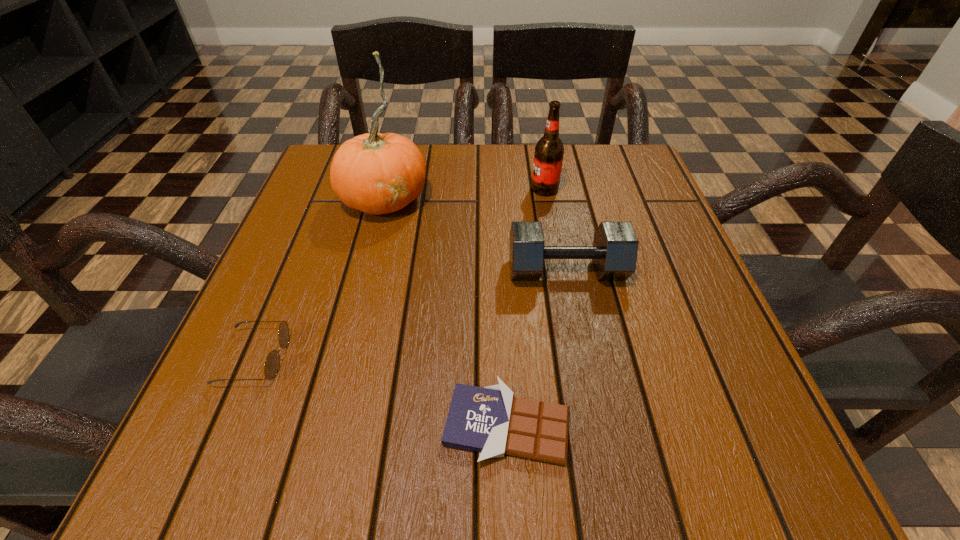
You are a GUI agent. You are given a task and a screenshot of the screen. Output one action in this format:
    pyautogui.click(x=<x>, y=<y>)
    Task: Click on the blank space at the right edge of the desktop
    The width and height of the screenshot is (960, 540).
    Given the screenshot: What is the action you would take?
    pyautogui.click(x=756, y=406)

Find the location of a particular element. The height and width of the screenshot is (540, 960). free space at the far right corner of the desktop is located at coordinates (598, 197).

What are the coordinates of `free space between the third farthest object and the sunglasses` in the screenshot? It's located at (411, 314).

Identify the location of free spot between the third farthest object and the pumpkin. (475, 234).

Image resolution: width=960 pixels, height=540 pixels. Find the location of `vacant region between the third farthest object and the root beer`. vacant region between the third farthest object and the root beer is located at coordinates (556, 230).

Identify the location of free space between the second tallest object and the pumpkin. (465, 193).

Locate an element on the screen. The width and height of the screenshot is (960, 540). vacant space that is in between the shortest object and the third shortest object is located at coordinates (537, 347).

Locate an element on the screen. The height and width of the screenshot is (540, 960). vacant space that is in between the fourth shortest object and the sunglasses is located at coordinates (399, 273).

Where is `free area in between the sunglasses and the tallest object`? This screenshot has width=960, height=540. free area in between the sunglasses and the tallest object is located at coordinates (320, 278).

Image resolution: width=960 pixels, height=540 pixels. In order to click on unoccupied position between the chocolate bar and the dumbbell in this screenshot , I will do click(x=537, y=347).